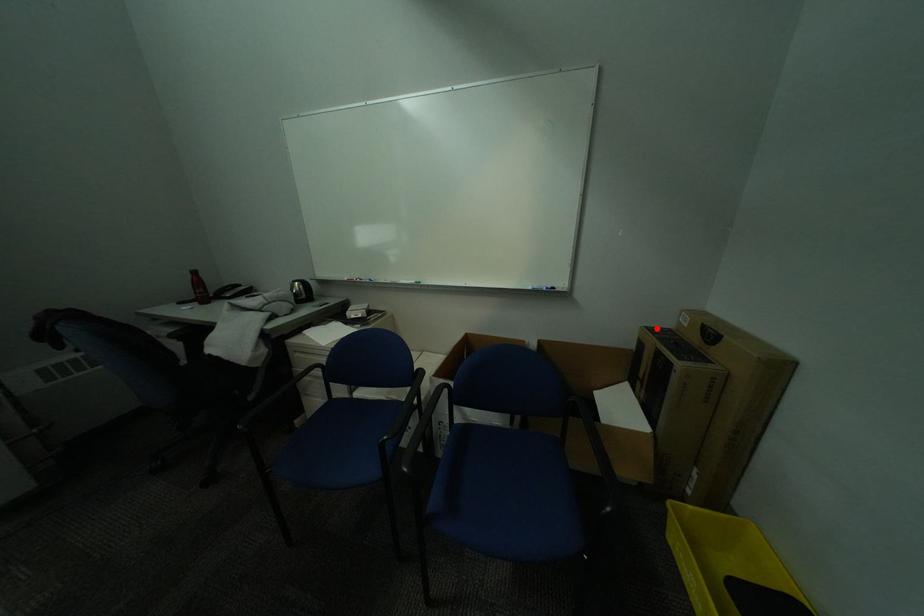
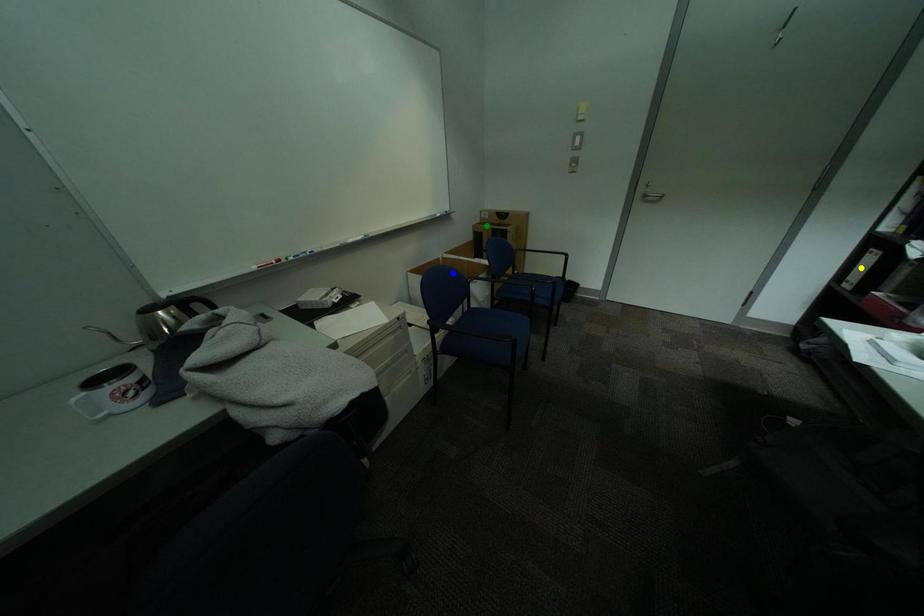
Question: I am providing you with two images of the same scene from different viewpoints. A red point is marked on the first image. You are given multiple points on the second image. Which spot in image 2 lines up with the point in image 1?

Choices:
 (A) yellow point
 (B) green point
 (C) blue point

Answer: (B)